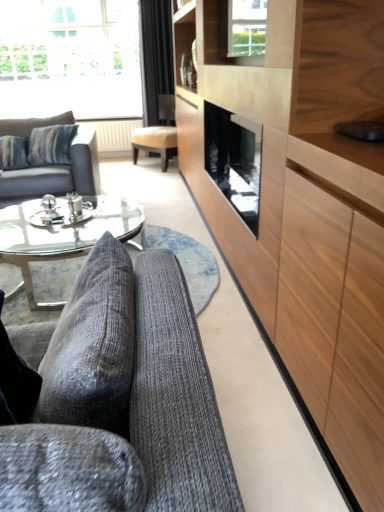
Question: From the image's perspective, is clear glass window at upper center, which is the first window from bottom to top, on top of transparent glass window at upper left, placed as the 2th window when sorted from bottom to top?

Choices:
 (A) yes
 (B) no

Answer: (B)

Question: Is clear glass window at upper center, placed as the 2th window when sorted from back to front, to the right of transparent glass window at upper left, which appears as the 1th window when viewed from the back, from the viewer's perspective?

Choices:
 (A) no
 (B) yes

Answer: (B)

Question: Can you confirm if clear glass window at upper center, placed as the 2th window when sorted from back to front, is shorter than transparent glass window at upper left, placed as the 2th window when sorted from bottom to top?

Choices:
 (A) no
 (B) yes

Answer: (B)

Question: Is transparent glass window at upper left, placed as the 2th window when sorted from bottom to top, inside clear glass window at upper center, the second window from the top?

Choices:
 (A) yes
 (B) no

Answer: (B)

Question: Is clear glass window at upper center, placed as the 2th window when sorted from back to front, smaller than transparent glass window at upper left, the 1th window in the left-to-right sequence?

Choices:
 (A) no
 (B) yes

Answer: (B)

Question: From a real-world perspective, does clear glass window at upper center, placed as the 2th window when sorted from left to right, stand above transparent glass window at upper left, placed as the 2th window when sorted from bottom to top?

Choices:
 (A) yes
 (B) no

Answer: (A)

Question: From the image's perspective, is transparent glass coffee table at center under wooden cabinet at right?

Choices:
 (A) yes
 (B) no

Answer: (A)

Question: Is transparent glass coffee table at center bigger than wooden cabinet at right?

Choices:
 (A) yes
 (B) no

Answer: (B)

Question: From the image's perspective, does transparent glass coffee table at center appear higher than wooden cabinet at right?

Choices:
 (A) no
 (B) yes

Answer: (A)

Question: Is transparent glass coffee table at center to the left of wooden cabinet at right from the viewer's perspective?

Choices:
 (A) yes
 (B) no

Answer: (A)

Question: Can we say transparent glass coffee table at center lies outside wooden cabinet at right?

Choices:
 (A) no
 (B) yes

Answer: (B)

Question: Can you confirm if transparent glass coffee table at center is taller than wooden cabinet at right?

Choices:
 (A) no
 (B) yes

Answer: (A)

Question: From a real-world perspective, is matte gray fabric couch at left, the 1th studio couch from the top, physically below black velvet curtain at upper center?

Choices:
 (A) no
 (B) yes

Answer: (B)